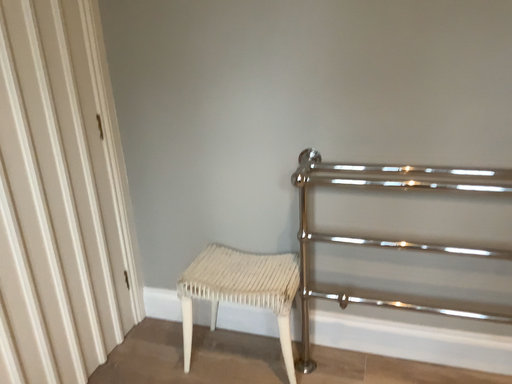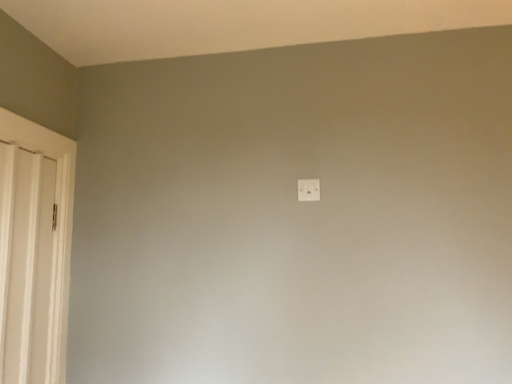
Question: Which way did the camera rotate in the video?

Choices:
 (A) rotated left
 (B) rotated right

Answer: (B)